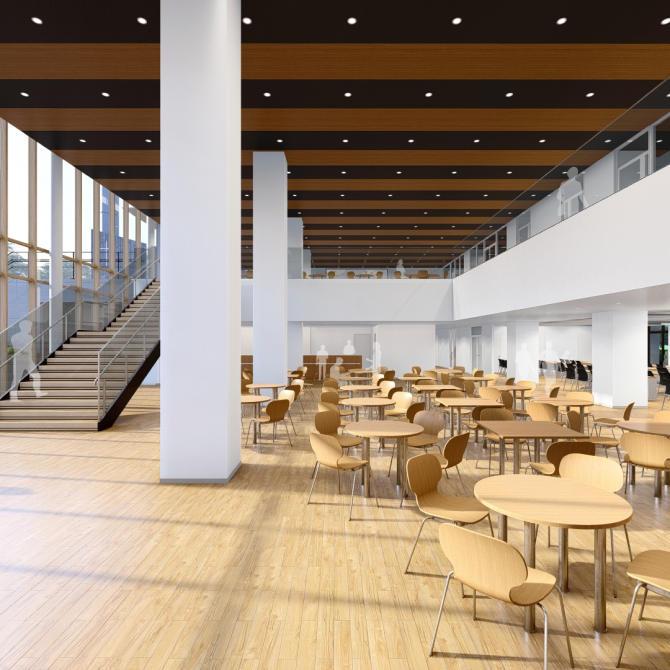
This screenshot has height=670, width=670. Find the location of `rectangle tables`. rectangle tables is located at coordinates (521, 427), (458, 403), (419, 387), (405, 379).